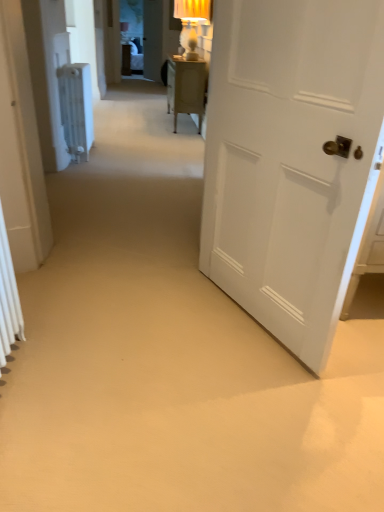
Question: Does point (89, 105) appear closer or farther from the camera than point (379, 154)?

Choices:
 (A) farther
 (B) closer

Answer: (A)

Question: Considering their positions, is white plastic radiator at left located in front of or behind white matte door at right, which is counted as the 2th door, starting from the back?

Choices:
 (A) front
 (B) behind

Answer: (B)

Question: Which object is the farthest from the white matte door at right, which is the 1th door in front-to-back order?

Choices:
 (A) white matte radiator at left, acting as the first door starting from the left
 (B) white plastic radiator at left

Answer: (B)

Question: Which of these objects is positioned farthest from the white plastic radiator at left?

Choices:
 (A) white matte radiator at left, which is the second door from right to left
 (B) white matte door at right, acting as the second door starting from the left

Answer: (B)